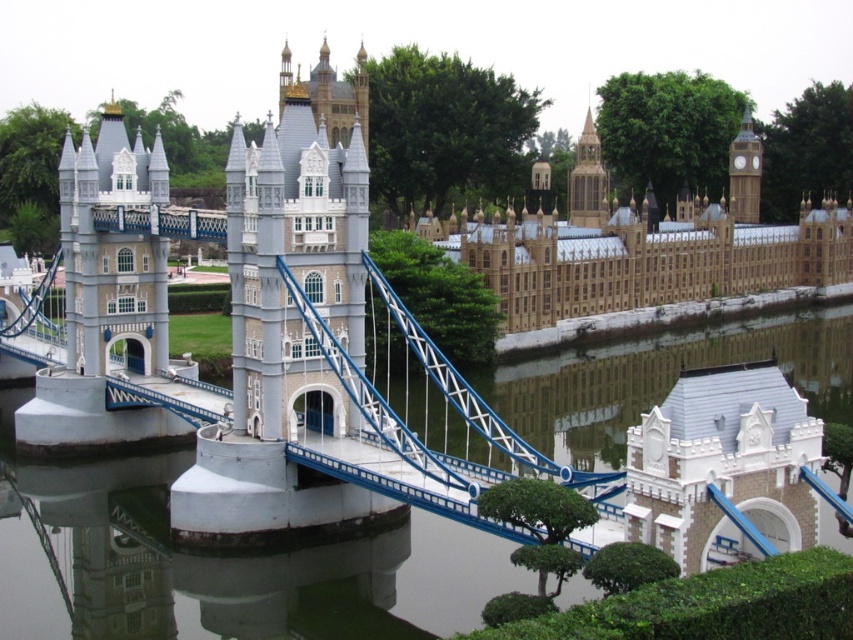
Question: Which object is closer to the camera taking this photo?

Choices:
 (A) beige stone building at upper right
 (B) golden stone clock tower at upper right
 (C) golden stone tower at upper center

Answer: (A)

Question: Does beige stone building at upper right lie behind golden stone clock tower at upper right?

Choices:
 (A) yes
 (B) no

Answer: (B)

Question: Does beige stone building at upper right have a lesser width compared to golden stone tower at upper center?

Choices:
 (A) no
 (B) yes

Answer: (A)

Question: Which point appears farthest from the camera in this image?

Choices:
 (A) (685, 227)
 (B) (589, 109)
 (C) (734, 196)

Answer: (B)

Question: Which point is farther to the camera?

Choices:
 (A) golden stone tower at upper center
 (B) golden stone clock tower at upper right

Answer: (B)

Question: Does golden stone tower at upper center appear over golden stone clock tower at upper right?

Choices:
 (A) no
 (B) yes

Answer: (B)